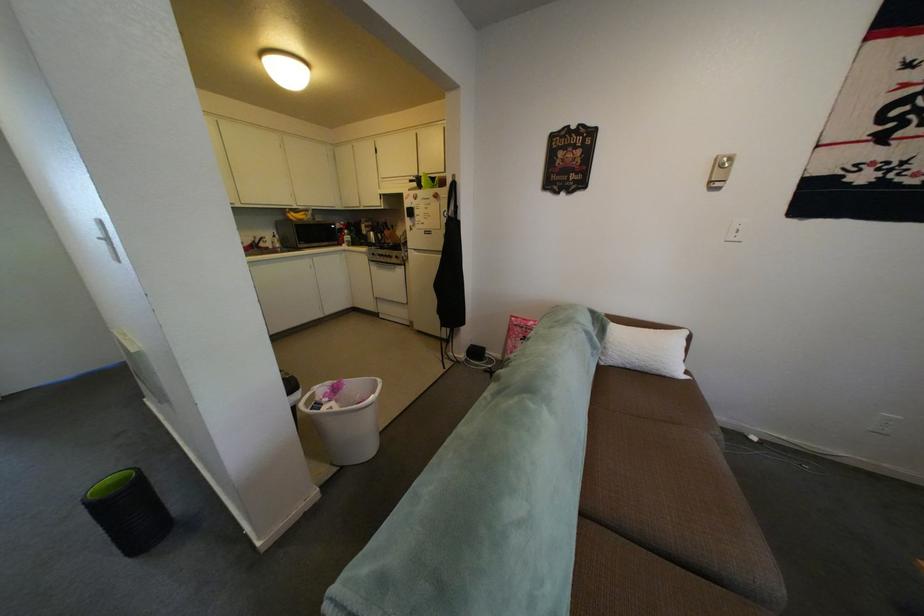
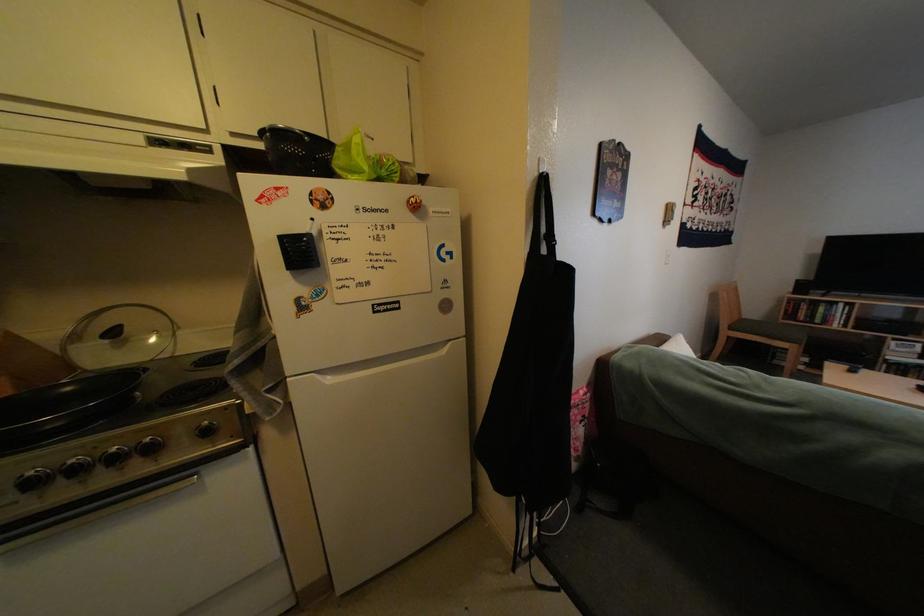
Locate, in the second image, the point that corresponds to (414,238) in the first image.

(71, 353)